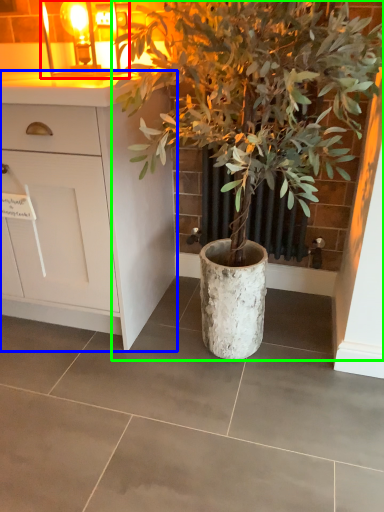
Question: Considering the real-world distances, which object is closest to light fixture (highlighted by a red box)? cabinetry (highlighted by a blue box) or houseplant (highlighted by a green box).

Choices:
 (A) cabinetry
 (B) houseplant

Answer: (A)